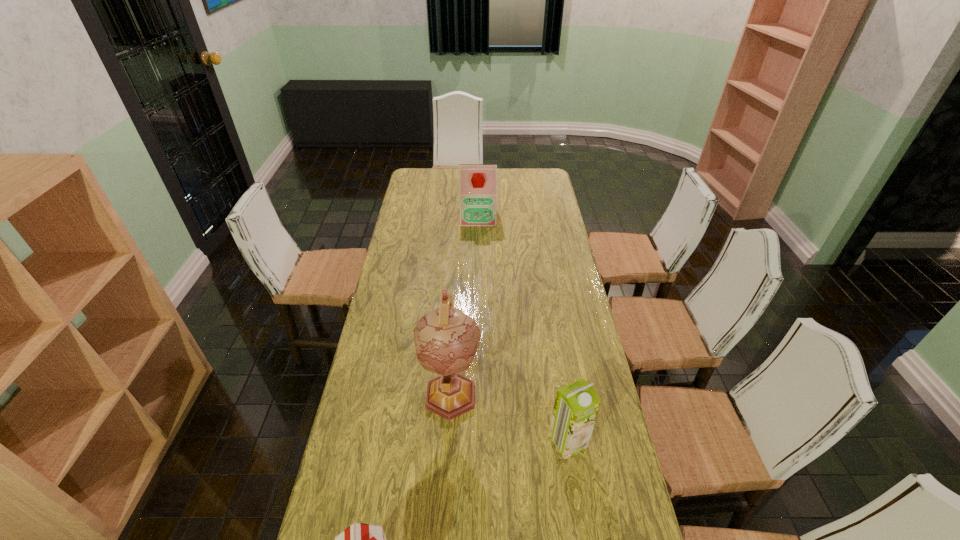
Locate an element on the screen. free region at the left edge of the desktop is located at coordinates (404, 225).

This screenshot has width=960, height=540. What are the coordinates of `free spot at the right edge of the desktop` in the screenshot? It's located at (575, 465).

Locate an element on the screen. This screenshot has height=540, width=960. vacant point located between the second farthest soya milk and the tallest object is located at coordinates (510, 417).

The image size is (960, 540). In order to click on empty location between the farthest soya milk and the globe in this screenshot , I will do `click(465, 305)`.

Locate an element on the screen. free space between the second soya milk from left to right and the globe is located at coordinates (465, 305).

What are the coordinates of `blank region between the rightmost object and the farthest object` in the screenshot? It's located at (523, 329).

Identify the location of empty space that is in between the rightmost soya milk and the tallest object. The height and width of the screenshot is (540, 960). (510, 417).

You are a GUI agent. You are given a task and a screenshot of the screen. Output one action in this format:
    pyautogui.click(x=<x>, y=<y>)
    Task: Click on the free space between the tallest object and the rightmost soya milk
    The width and height of the screenshot is (960, 540).
    Given the screenshot: What is the action you would take?
    pyautogui.click(x=510, y=417)

The image size is (960, 540). What are the coordinates of `free point between the farthest object and the tallest object` in the screenshot? It's located at (465, 305).

Where is `object that ranks as the second closest to the second soya milk from right to left`? Image resolution: width=960 pixels, height=540 pixels. object that ranks as the second closest to the second soya milk from right to left is located at coordinates (576, 406).